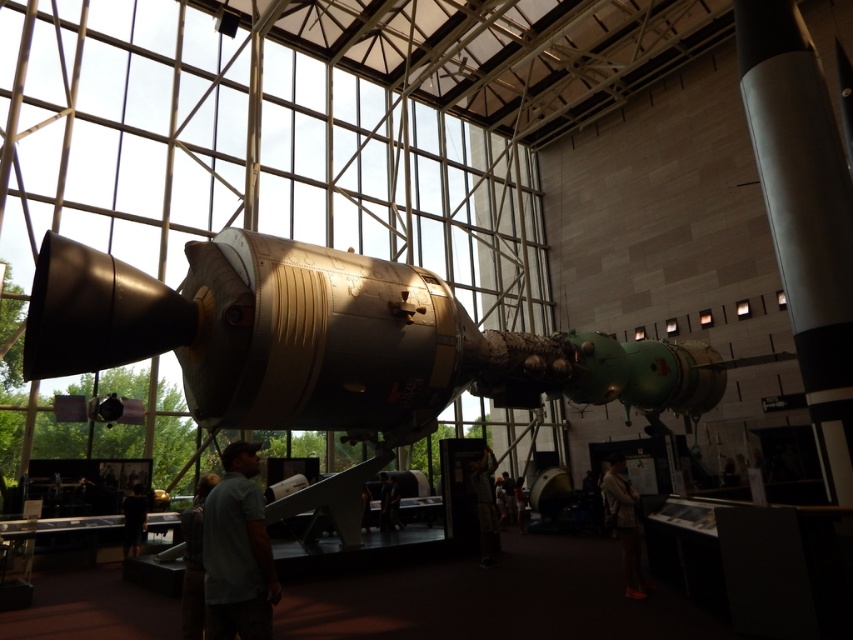
Which is more to the right, gray cotton shirt at lower left or camouflage pants at center?

From the viewer's perspective, camouflage pants at center appears more on the right side.

Is point (207, 508) positioned after point (490, 534)?

That is False.

Locate an element on the screen. This screenshot has height=640, width=853. gray cotton shirt at lower left is located at coordinates (236, 552).

Consider the image. Does light brown leather jacket at lower right have a greater width compared to dark fabric pants at lower center?

Incorrect, light brown leather jacket at lower right's width does not surpass dark fabric pants at lower center's.

Who is more forward, (627, 544) or (131, 513)?

Point (627, 544)

Is point (637, 577) farther from camera compared to point (138, 513)?

No, it is not.

Identify the location of light brown leather jacket at lower right. The image size is (853, 640). (624, 524).

Does light brown leather jacket at lower center have a lesser width compared to camouflage pants at center?

Yes, light brown leather jacket at lower center is thinner than camouflage pants at center.

This screenshot has width=853, height=640. In order to click on light brown leather jacket at lower center in this screenshot , I will do `click(194, 561)`.

The width and height of the screenshot is (853, 640). In order to click on light brown leather jacket at lower center in this screenshot , I will do `click(194, 561)`.

Where is `light brown leather jacket at lower center`? light brown leather jacket at lower center is located at coordinates (194, 561).